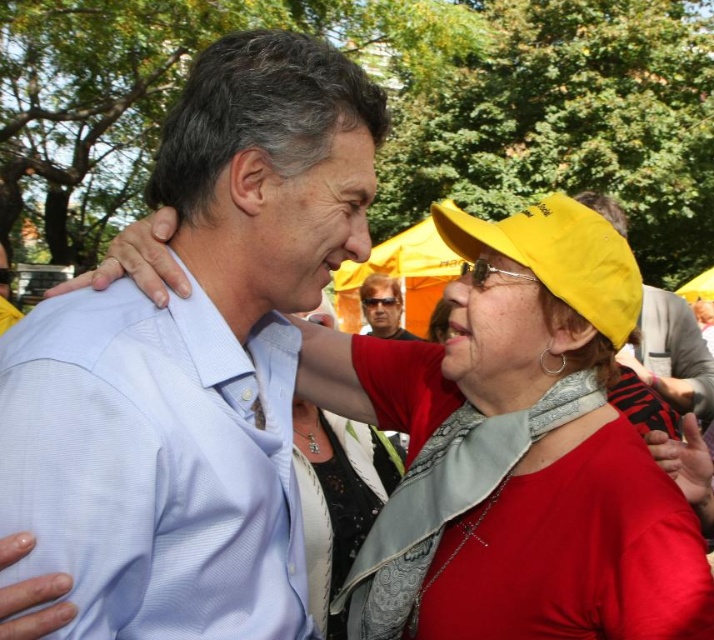
You are standing in the scene and want to find the matte yellow hat at upper right. According to the coordinates provided, where should you look relative to the center of the image?

The matte yellow hat at upper right is located at coordinates 0.553 on the x axis and 0.941 on the y axis, which means it is positioned to the right and above the center of the image.

You are standing at the camera position and want to estimate how far the light blue shirt at center is from you. Can you guess the distance in feet?

The light blue shirt at center is 5.93 feet away from the camera, so the distance is approximately 5.93 feet.